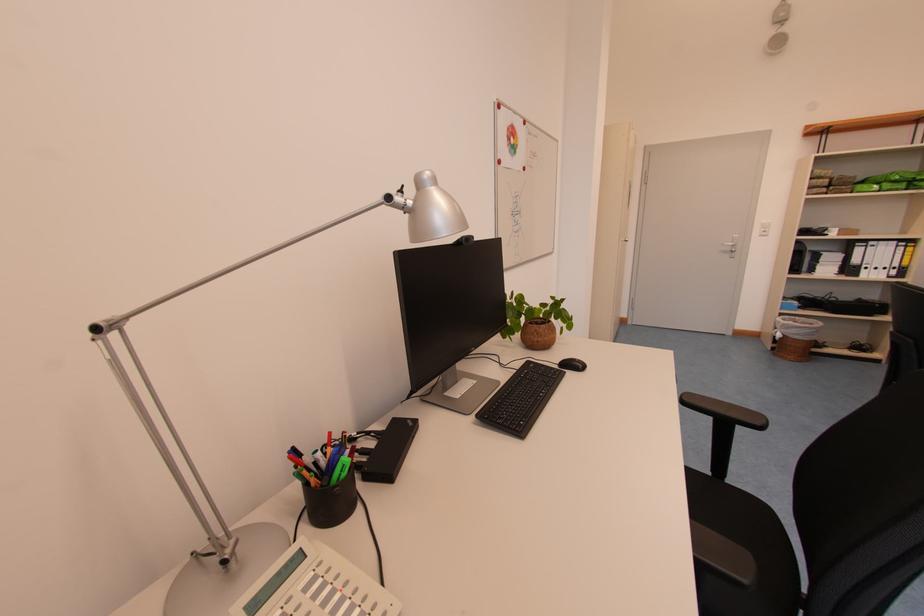
This screenshot has height=616, width=924. Describe the element at coordinates (723, 411) in the screenshot. I see `a black chair armrest` at that location.